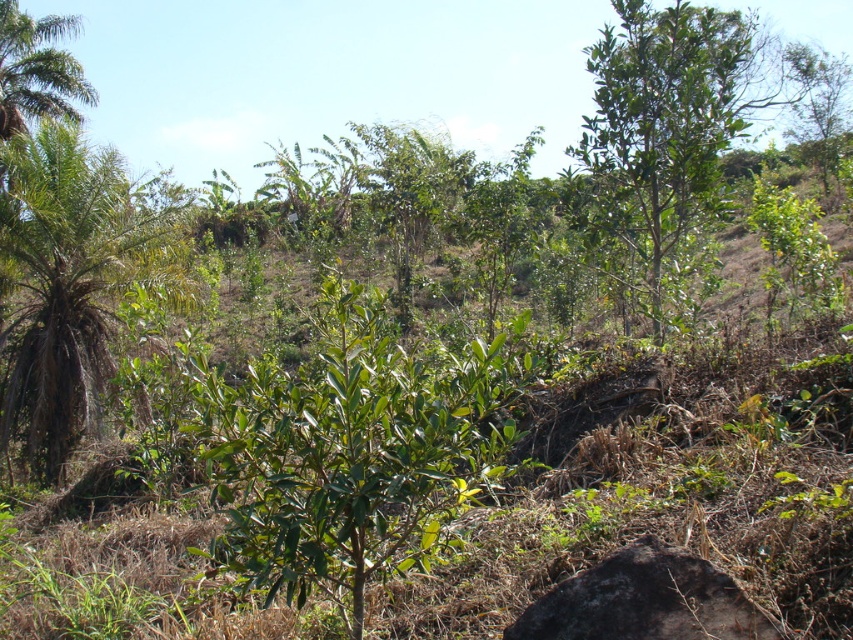
You are standing in the natural landscape described and want to locate the green leafy palm tree at left. According to the coordinates provided, where should you look relative to your position?

The green leafy palm tree at left is located at coordinates point (67, 282), which means it is positioned to the left and slightly forward from your current viewpoint.

You are a hiker planning to take a photo of both the green leafy tree at upper right and the green leafy palm tree at left. Which tree should you position closer to the camera to ensure both are fully visible in the frame?

To ensure both the green leafy tree at upper right and the green leafy palm tree at left are fully visible in the frame, you should position the green leafy palm tree at left closer to the camera. Since the green leafy tree at upper right is larger in size than the green leafy palm tree at left, placing the smaller palm tree nearer will help balance their apparent sizes in the photo.

You are standing at the base of the green leafy tree at upper right and want to take a photo of it using a camera that has a maximum focus range of 6 meters. Will the camera be able to focus on the tree?

The distance of green leafy tree at upper right from camera is 5.93 meters, which is within the camera maximum focus range of 6 meters. Therefore, the camera can focus on the tree.